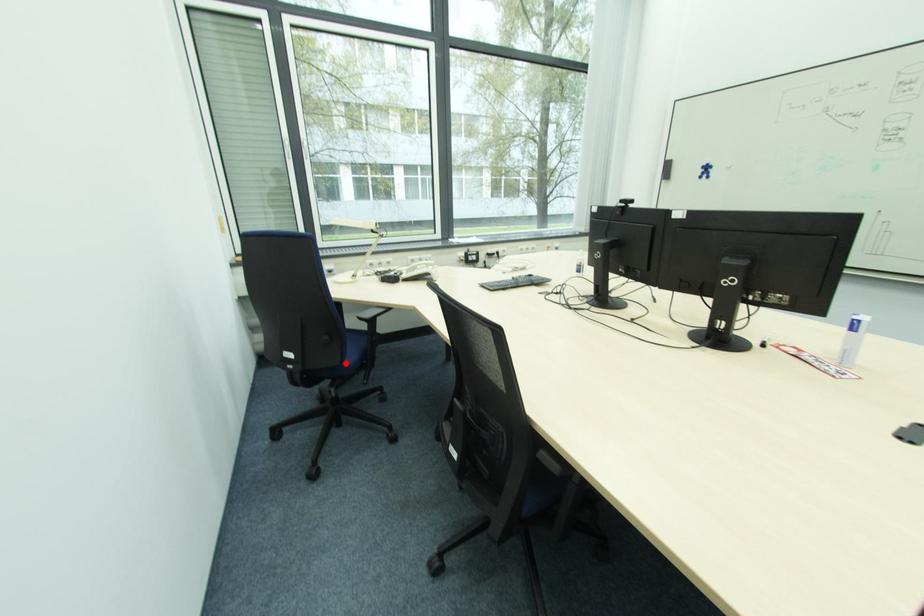
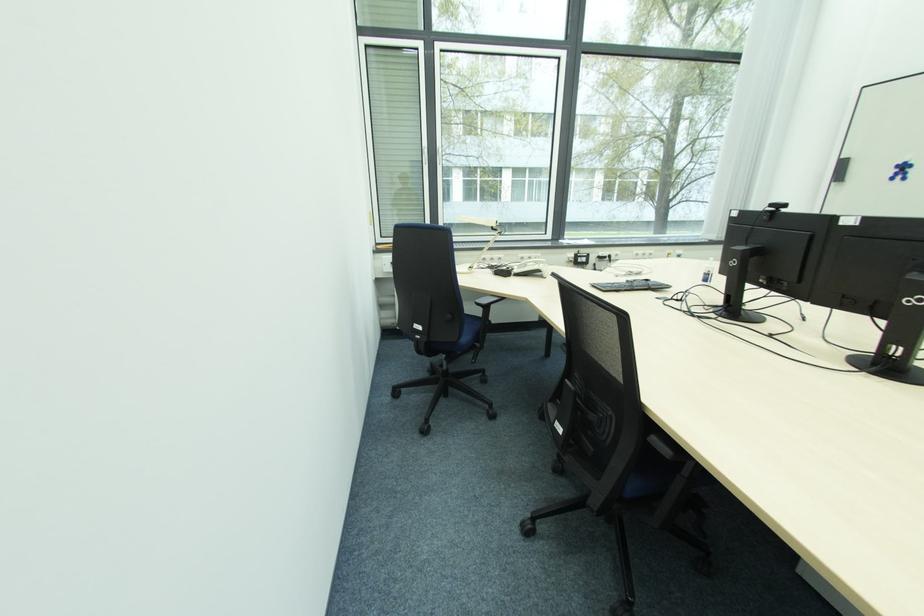
Question: I am providing you with two images of the same scene from different viewpoints. A red point is shown in image1. For the corresponding object point in image2, is it positioned nearer or farther from the camera?

Choices:
 (A) Nearer
 (B) Farther

Answer: (B)